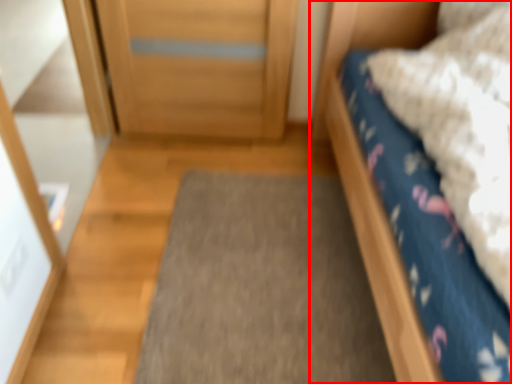
Question: From the image's perspective, where is bed (annotated by the red box) located relative to doormat?

Choices:
 (A) above
 (B) below

Answer: (A)